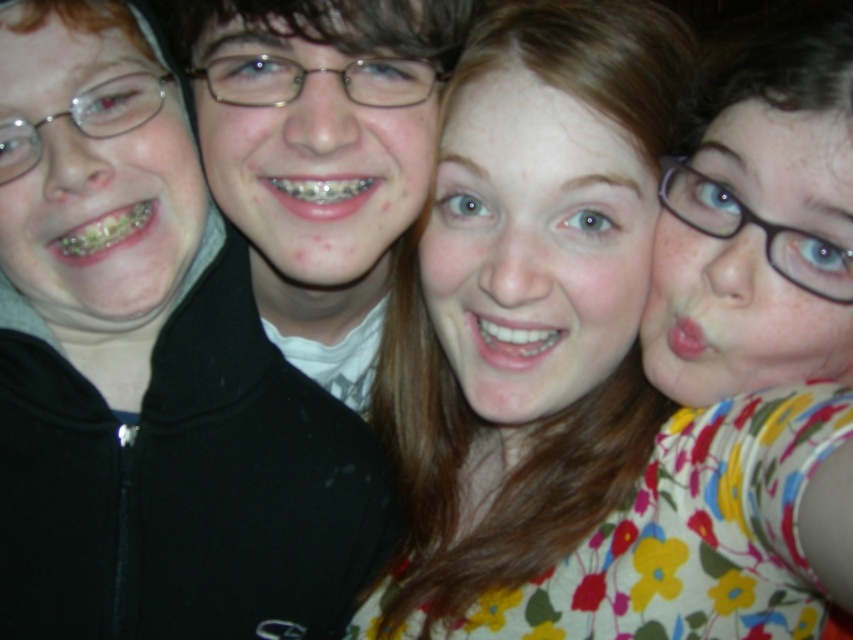
Question: Is floral fabric dress at center thinner than matte black jacket at center?

Choices:
 (A) yes
 (B) no

Answer: (B)

Question: Which object appears farthest from the camera in this image?

Choices:
 (A) floral fabric dress at center
 (B) matte floral shirt at center
 (C) matte black jacket at center

Answer: (B)

Question: Which of these objects is positioned farthest from the matte black jacket at center?

Choices:
 (A) floral fabric dress at center
 (B) matte floral shirt at center

Answer: (A)

Question: From the image, what is the correct spatial relationship of floral fabric dress at center in relation to matte floral shirt at center?

Choices:
 (A) above
 (B) below

Answer: (A)

Question: Which of the following is the farthest from the observer?

Choices:
 (A) (276, 244)
 (B) (479, 422)
 (C) (329, 538)

Answer: (B)

Question: Can you confirm if matte floral shirt at center is positioned below matte black jacket at center?

Choices:
 (A) yes
 (B) no

Answer: (A)